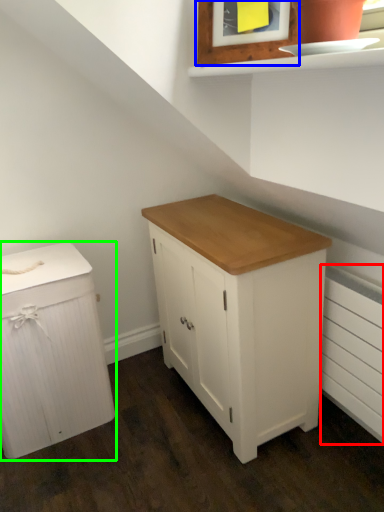
Question: Considering the real-world distances, which object is closest to radiator (highlighted by a red box)? picture frame (highlighted by a blue box) or chest of drawers (highlighted by a green box).

Choices:
 (A) picture frame
 (B) chest of drawers

Answer: (A)